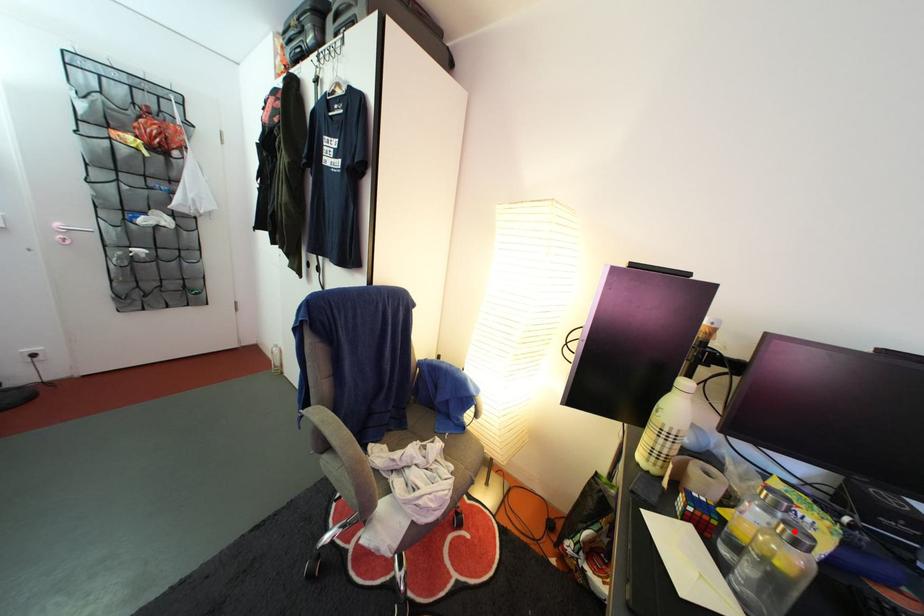
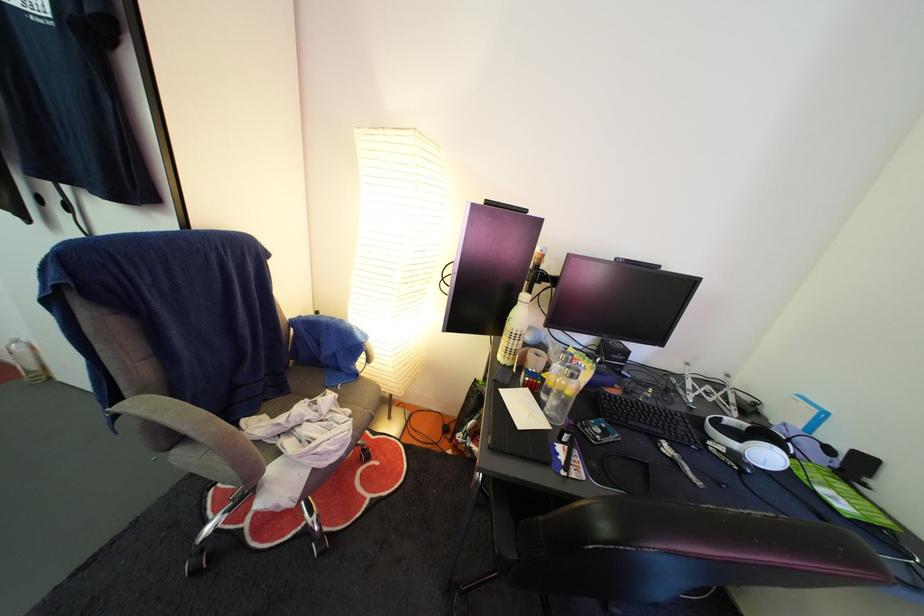
Find the pixel in the second image that matches the highlighted location in the first image.

(578, 376)